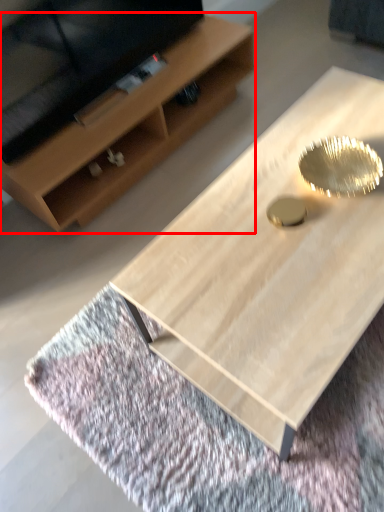
Question: From the image's perspective, what is the correct spatial relationship of shelf (annotated by the red box) in relation to coffee table?

Choices:
 (A) above
 (B) below

Answer: (A)